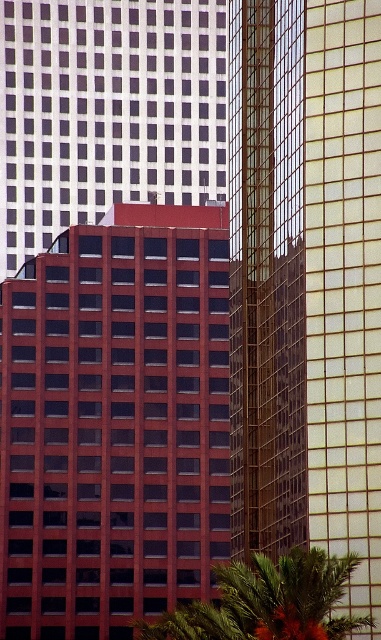
Question: Which object appears farthest from the camera in this image?

Choices:
 (A) matte glass building at center
 (B) green leafy tree at lower center

Answer: (A)

Question: Can you confirm if matte glass building at center is bigger than green leafy tree at lower center?

Choices:
 (A) no
 (B) yes

Answer: (A)

Question: Which of the following is the closest to the observer?

Choices:
 (A) green leafy tree at lower center
 (B) matte glass building at center

Answer: (A)

Question: Can you confirm if matte glass building at center is thinner than green leafy tree at lower center?

Choices:
 (A) no
 (B) yes

Answer: (A)

Question: Which point is farther to the camera?

Choices:
 (A) (254, 557)
 (B) (204, 570)

Answer: (B)

Question: Does matte glass building at center lie behind green leafy tree at lower center?

Choices:
 (A) yes
 (B) no

Answer: (A)